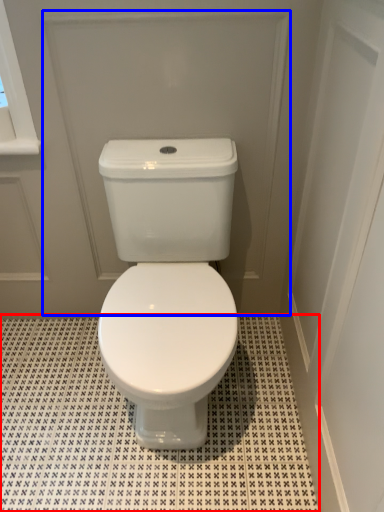
Question: Among these objects, which one is nearest to the camera, tile (highlighted by a red box) or screen door (highlighted by a blue box)?

Choices:
 (A) tile
 (B) screen door

Answer: (B)